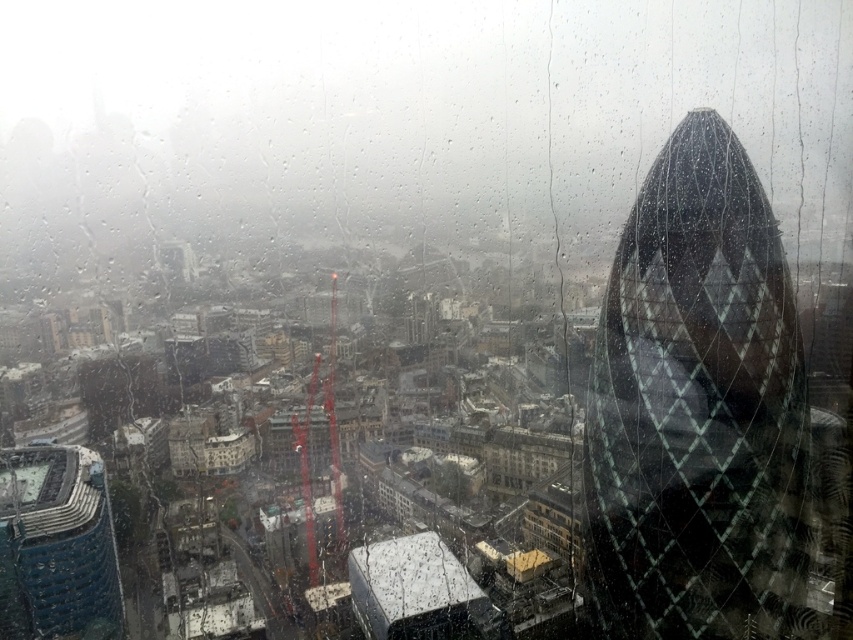
Question: Which point is farther to the camera?

Choices:
 (A) blue glass tower at lower left
 (B) glassy diamond-patterned tower at right

Answer: (A)

Question: Can you confirm if glassy diamond-patterned tower at right is positioned above blue glass tower at lower left?

Choices:
 (A) no
 (B) yes

Answer: (B)

Question: Can you confirm if glassy diamond-patterned tower at right is smaller than blue glass tower at lower left?

Choices:
 (A) yes
 (B) no

Answer: (B)

Question: Which object appears farthest from the camera in this image?

Choices:
 (A) glassy diamond-patterned tower at right
 (B) blue glass tower at lower left

Answer: (B)

Question: Can you confirm if glassy diamond-patterned tower at right is bigger than blue glass tower at lower left?

Choices:
 (A) yes
 (B) no

Answer: (A)

Question: Which object appears closest to the camera in this image?

Choices:
 (A) glassy diamond-patterned tower at right
 (B) blue glass tower at lower left

Answer: (A)